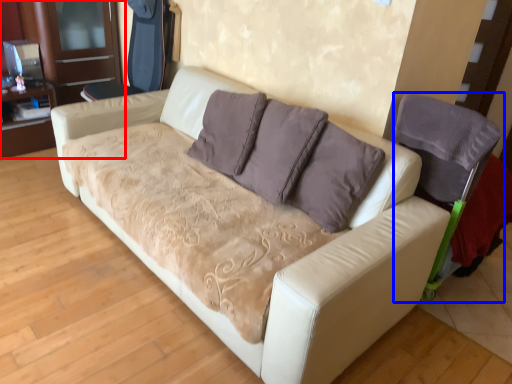
Question: Which point is further to the camera, dresser (highlighted by a red box) or armchair (highlighted by a blue box)?

Choices:
 (A) dresser
 (B) armchair

Answer: (A)